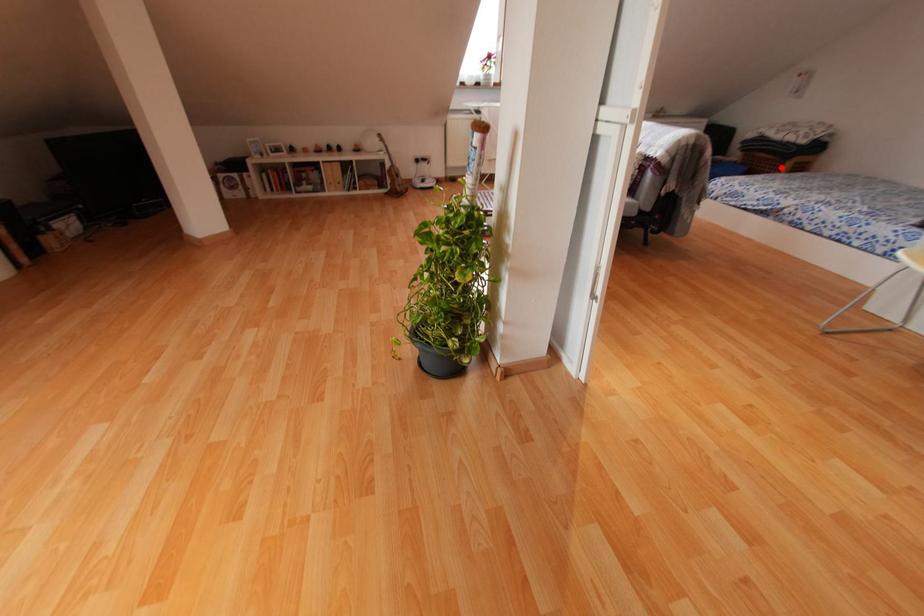
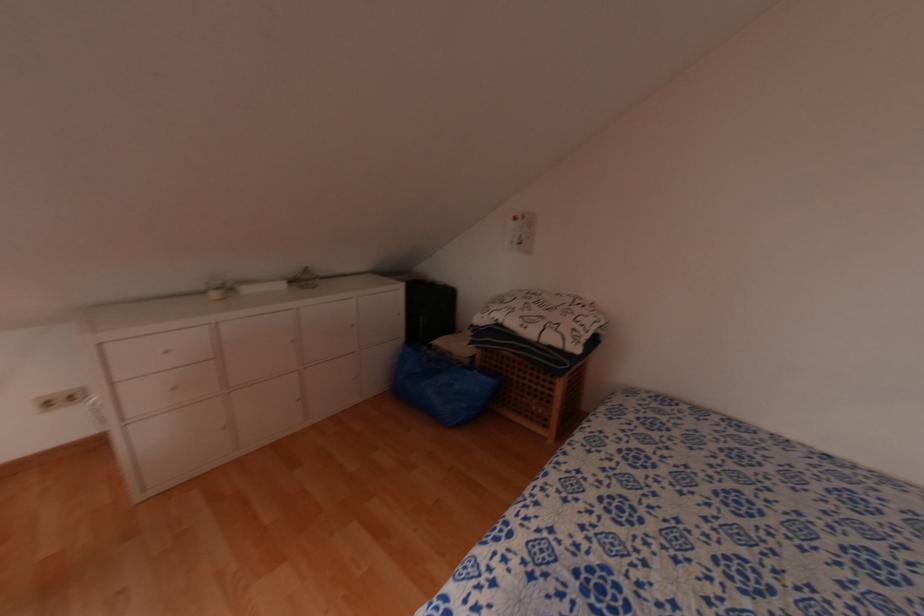
The point at the highlighted location is marked in the first image. Where is the corresponding point in the second image?

(552, 384)